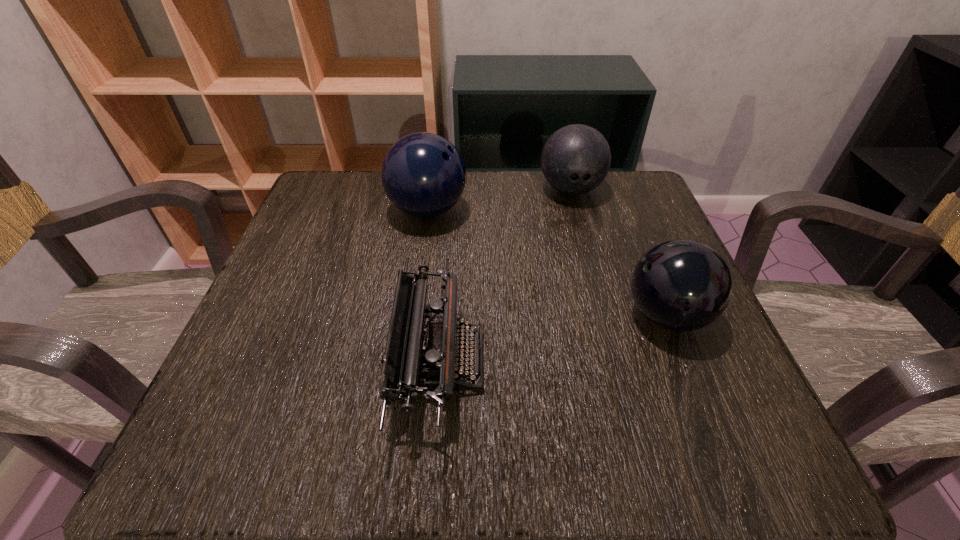
You are a GUI agent. You are given a task and a screenshot of the screen. Output one action in this format:
    pyautogui.click(x=<x>, y=<y>)
    Task: Click on the empty location between the nearest bowling ball and the typewriter
    
    Given the screenshot: What is the action you would take?
    pyautogui.click(x=553, y=338)

The width and height of the screenshot is (960, 540). In order to click on free space between the typewriter and the leftmost bowling ball in this screenshot , I will do `click(434, 286)`.

Identify the location of vacant point located between the leftmost bowling ball and the typewriter. Image resolution: width=960 pixels, height=540 pixels. (434, 286).

Find the location of a particular element. The height and width of the screenshot is (540, 960). the second closest object to the leftmost bowling ball is located at coordinates (575, 160).

Select which object is the second closest to the leftmost bowling ball. Please provide its 2D coordinates. Your answer should be formatted as a tuple, i.e. [(x, y)], where the tuple contains the x and y coordinates of a point satisfying the conditions above.

[(575, 160)]

Select which bowling ball appears as the closest to the leftmost bowling ball. Please provide its 2D coordinates. Your answer should be formatted as a tuple, i.e. [(x, y)], where the tuple contains the x and y coordinates of a point satisfying the conditions above.

[(575, 160)]

Where is `the closest bowling ball relative to the nearest bowling ball`? This screenshot has width=960, height=540. the closest bowling ball relative to the nearest bowling ball is located at coordinates (575, 160).